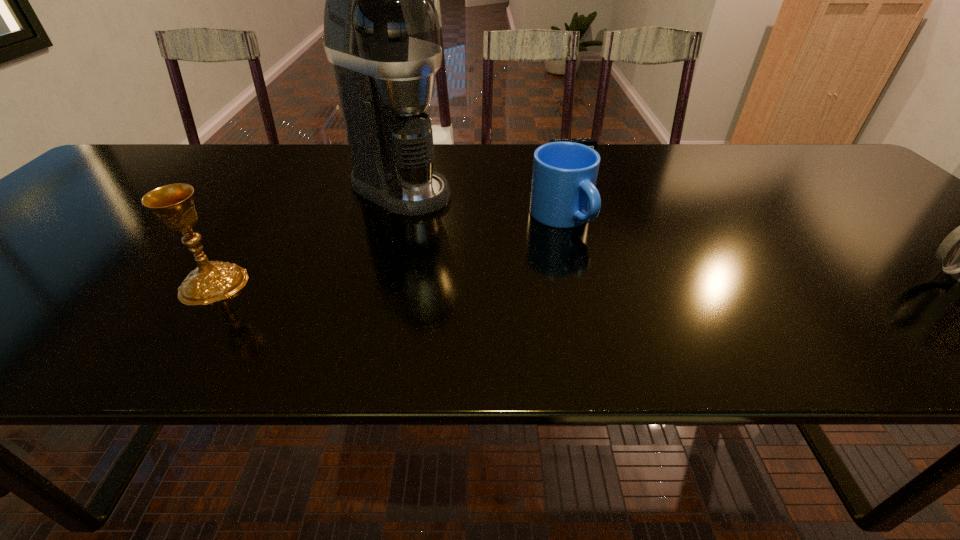
Locate an element on the screen. free spot on the desktop that is between the fourth shortest object and the nearer mug and is positioned on the front-facing side of the alarm clock is located at coordinates (639, 280).

Where is `vacant space on the desktop that is between the chalice and the rightmost object and is positioned on the side of the left mug with the handle`? This screenshot has width=960, height=540. vacant space on the desktop that is between the chalice and the rightmost object and is positioned on the side of the left mug with the handle is located at coordinates (636, 280).

The width and height of the screenshot is (960, 540). What are the coordinates of `vacant space on the desktop that is between the leftmost object and the nearer mug and is positioned place cup under the spout of the fourth object from right to left` in the screenshot? It's located at (582, 281).